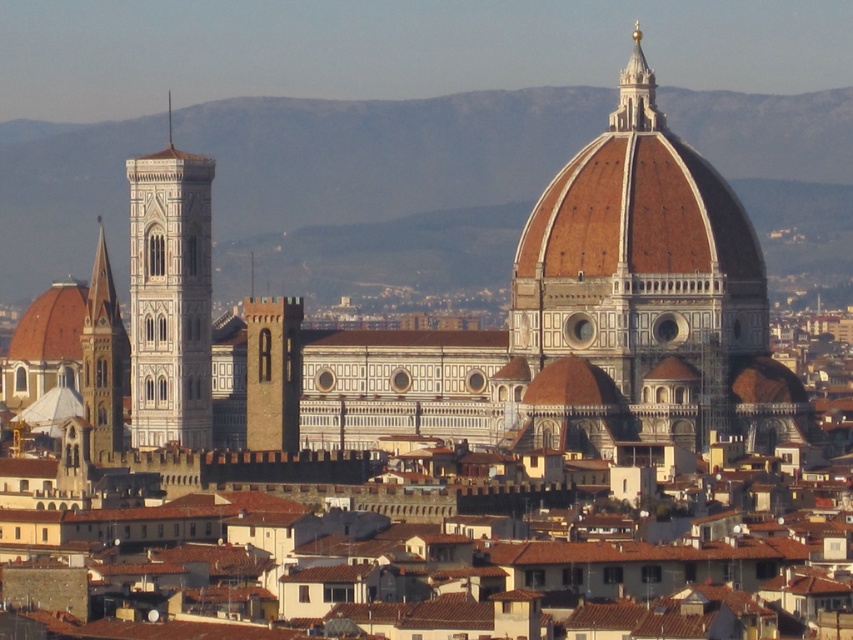
Can you confirm if brown stone tower at center is positioned above golden stone tower at left?

Incorrect, brown stone tower at center is not positioned above golden stone tower at left.

Between point (281, 444) and point (99, 369), which one is positioned behind?

Positioned behind is point (99, 369).

Does point (264, 426) come behind point (102, 452)?

No, (264, 426) is closer to viewer.

Where is `brown stone tower at center`? This screenshot has width=853, height=640. brown stone tower at center is located at coordinates (271, 372).

Is golden stone tower at left closer to the viewer compared to gold metallic spire at upper center?

Yes, it is in front of gold metallic spire at upper center.

Can you confirm if golden stone tower at left is wider than gold metallic spire at upper center?

Indeed, golden stone tower at left has a greater width compared to gold metallic spire at upper center.

This screenshot has height=640, width=853. I want to click on golden stone tower at left, so click(103, 362).

Image resolution: width=853 pixels, height=640 pixels. Find the location of `golden stone tower at left`. golden stone tower at left is located at coordinates (103, 362).

Find the location of a particular element. This screenshot has height=640, width=853. brown stone tower at center is located at coordinates (271, 372).

Who is positioned more to the left, brown stone tower at center or gold metallic spire at upper center?

brown stone tower at center is more to the left.

Measure the distance between point (288, 332) and camera.

A distance of 343.77 meters exists between point (288, 332) and camera.

You are a GUI agent. You are given a task and a screenshot of the screen. Output one action in this format:
    pyautogui.click(x=<x>, y=<y>)
    Task: Click on the brown stone tower at center
    Image resolution: width=853 pixels, height=640 pixels.
    Given the screenshot: What is the action you would take?
    pyautogui.click(x=271, y=372)